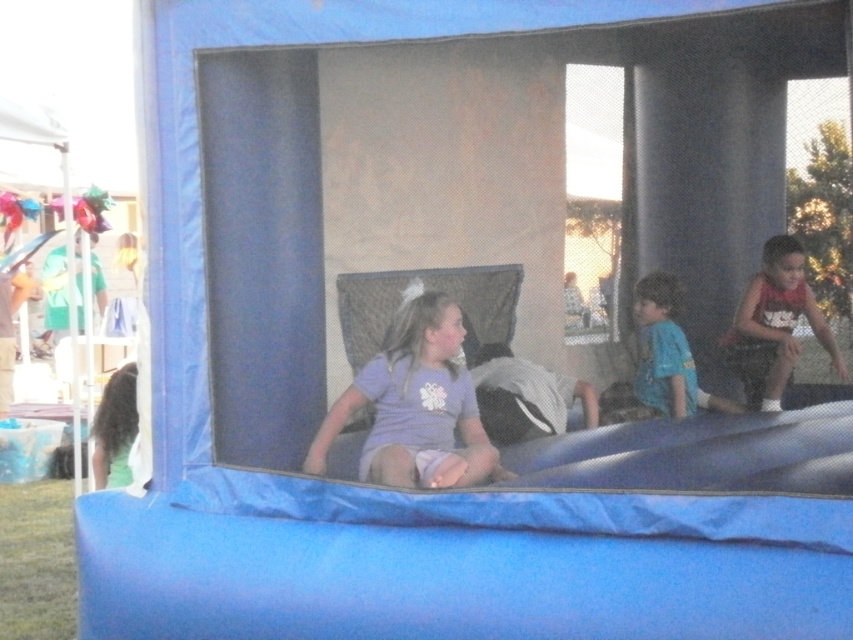
Can you confirm if reddish-brown tank top at right is bigger than blue cotton shirt at center?

No.

Identify the location of reddish-brown tank top at right. (775, 324).

Does point (433, 365) come closer to viewer compared to point (676, 401)?

That is True.

In the scene shown: Who is taller, purple matte shirt at center or blue cotton shirt at center?

blue cotton shirt at center is taller.

Describe the element at coordinates (415, 404) in the screenshot. I see `purple matte shirt at center` at that location.

Find the location of a particular element. purple matte shirt at center is located at coordinates (415, 404).

Who is taller, purple matte shirt at center or reddish-brown tank top at right?

With more height is reddish-brown tank top at right.

Which is below, purple matte shirt at center or reddish-brown tank top at right?

purple matte shirt at center is lower down.

You are a GUI agent. You are given a task and a screenshot of the screen. Output one action in this format:
    pyautogui.click(x=<x>, y=<y>)
    Task: Click on the purple matte shirt at center
    
    Given the screenshot: What is the action you would take?
    pyautogui.click(x=415, y=404)